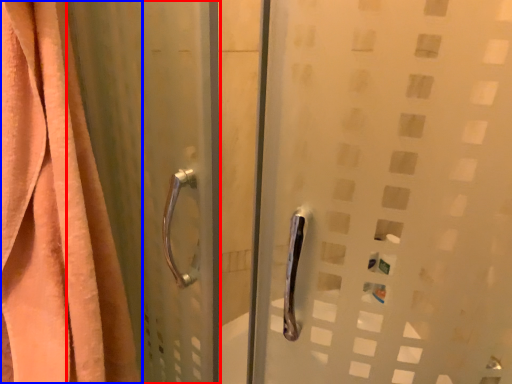
Question: Which point is closer to the camera, screen door (highlighted by a red box) or curtain (highlighted by a blue box)?

Choices:
 (A) screen door
 (B) curtain

Answer: (A)